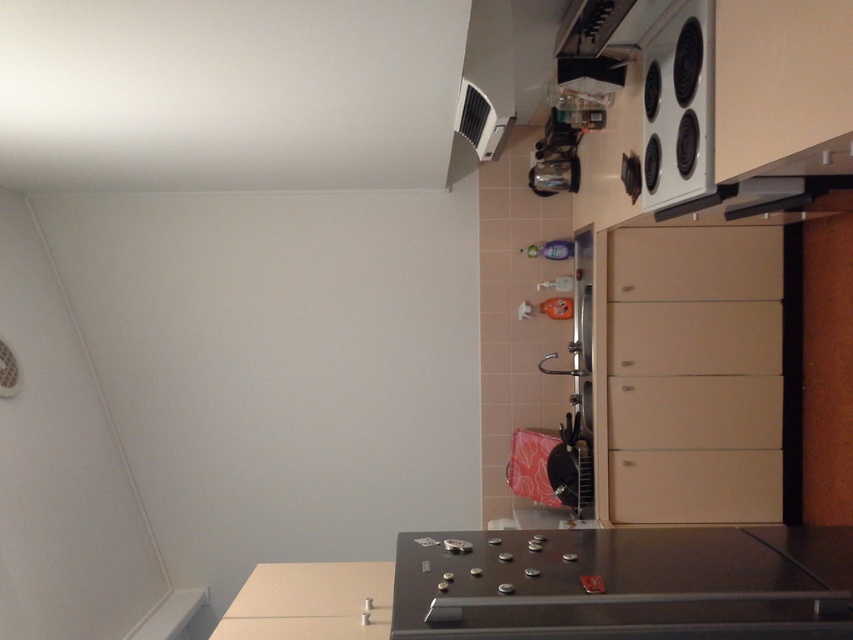
You are standing in the kitchen and want to reach both points mentioned. Which point is closer to you, point (x=711, y=541) or point (x=654, y=182)?

Point (x=711, y=541) is closer to you than point (x=654, y=182).

You are organizing the kitchen and need to place a new appliance that requires a surface area larger than the white glossy electric stove at upper right. Based on the scene, can the black matte countertop at lower center accommodate this appliance?

The black matte countertop at lower center has a larger width than the white glossy electric stove at upper right, so it can accommodate the appliance requiring a larger surface area.

You are standing in the kitchen and want to reach the point at coordinates point (408,618). If you are 5.70 feet away from it, can you comfortably stretch to touch it without moving your feet?

The point (408,618) is 5.70 feet away from you. The average comfortable stretching distance for an adult is about 2 to 3 feet. Since 5.70 feet exceeds this range, you likely cannot comfortably reach it without moving your feet.